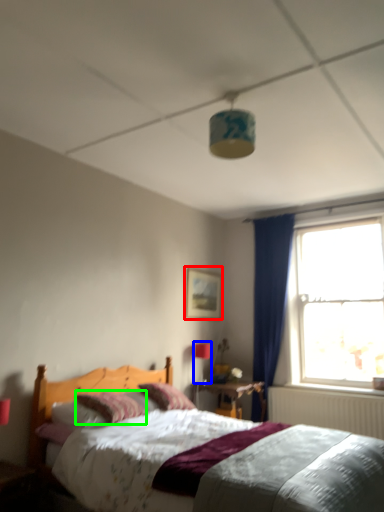
Question: Which object is positioned closest to picture frame (highlighted by a red box)? Select from light fixture (highlighted by a blue box) and pillow (highlighted by a green box).

Choices:
 (A) light fixture
 (B) pillow

Answer: (A)